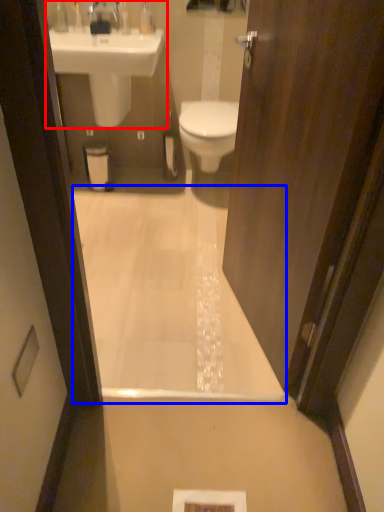
Question: Which of the following is the farthest to the observer, sink (highlighted by a red box) or bath (highlighted by a blue box)?

Choices:
 (A) sink
 (B) bath

Answer: (A)